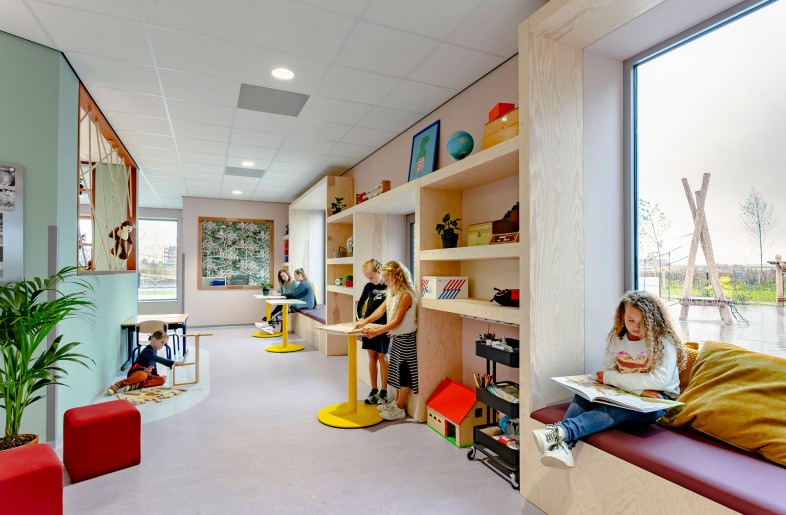
You are a GUI agent. You are given a task and a screenshot of the screen. Output one action in this format:
    pyautogui.click(x=<x>, y=<y>)
    Task: Click on the ceiling
    
    Given the screenshot: What is the action you would take?
    pyautogui.click(x=302, y=23)